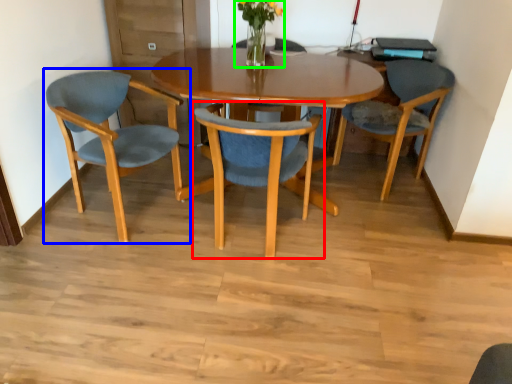
Question: Based on their relative distances, which object is nearer to chair (highlighted by a red box)? Choose from chair (highlighted by a blue box) and floral arrangement (highlighted by a green box).

Choices:
 (A) chair
 (B) floral arrangement

Answer: (A)